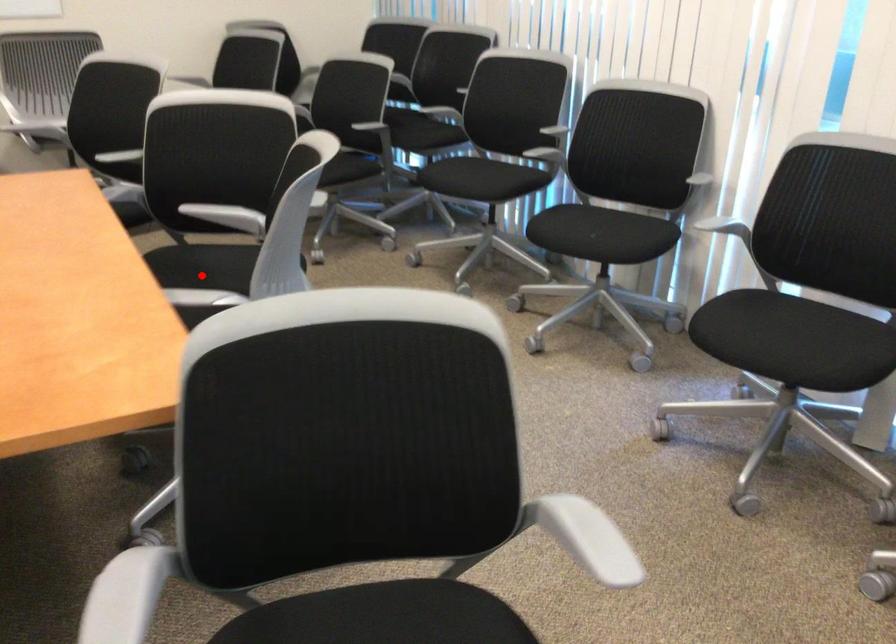
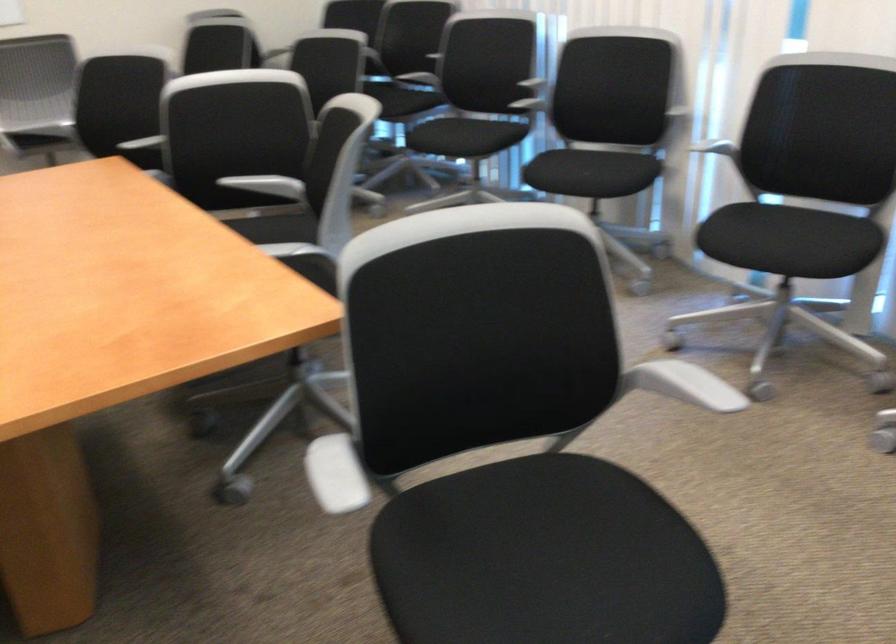
Question: I am providing you with two images of the same scene from different viewpoints. A red point is marked on the first image. Is the red point's position out of view in image 2?

Choices:
 (A) Yes
 (B) No

Answer: (A)